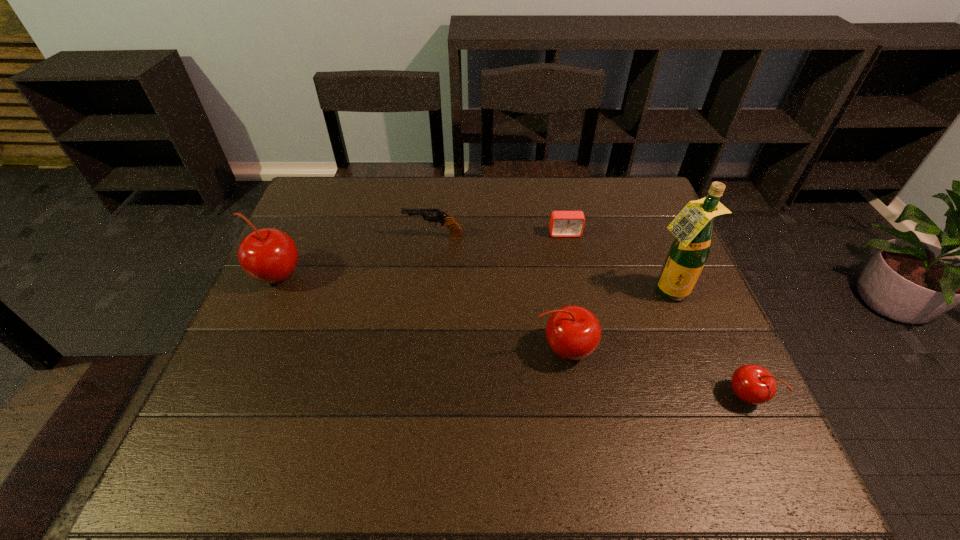
I want to click on liquor at the right edge, so click(x=693, y=227).

At what (x,y) coordinates should I click in order to perform the action: click on object that is at the near right corner. Please return your answer as a coordinate pair (x, y). Looking at the image, I should click on (753, 384).

This screenshot has height=540, width=960. I want to click on free space at the far edge, so [599, 188].

Locate an element on the screen. Image resolution: width=960 pixels, height=540 pixels. free location at the near edge is located at coordinates (498, 404).

The width and height of the screenshot is (960, 540). What are the coordinates of `vacant space at the left edge` in the screenshot? It's located at (279, 350).

This screenshot has height=540, width=960. In the image, there is a desktop. In order to click on free space at the right edge in this screenshot , I will do `click(664, 339)`.

I want to click on free space at the near left corner of the desktop, so click(x=210, y=415).

At what (x,y) coordinates should I click in order to perform the action: click on free location at the far right corner. Please return your answer as a coordinate pair (x, y). The image size is (960, 540). Looking at the image, I should click on (604, 179).

The height and width of the screenshot is (540, 960). I want to click on vacant point located between the leftmost object and the fifth object from right to left, so click(x=355, y=256).

Locate an element on the screen. empty space that is in between the alarm clock and the leftmost object is located at coordinates [x=420, y=255].